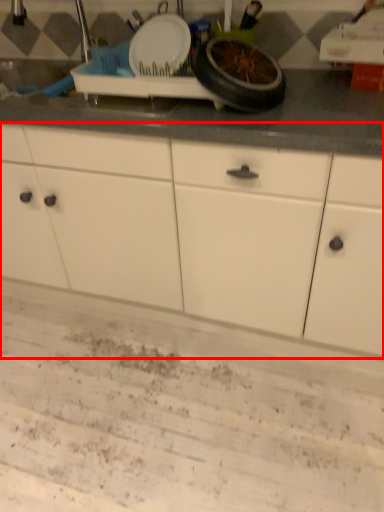
Question: Considering the relative positions of cabinetry (annotated by the red box) and wheel in the image provided, where is cabinetry (annotated by the red box) located with respect to the staircase?

Choices:
 (A) left
 (B) right

Answer: (A)